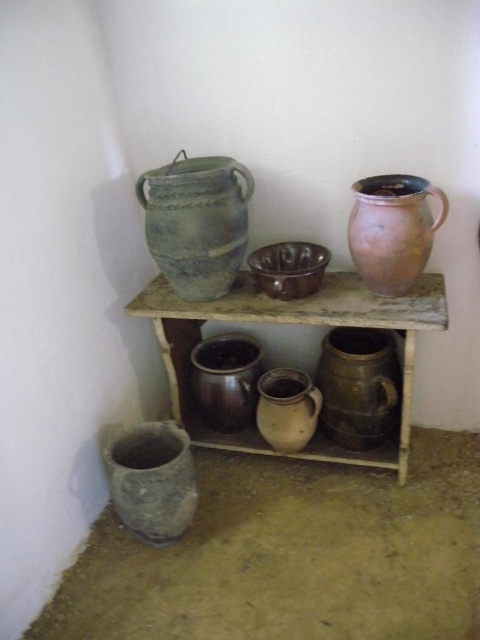
Question: Which point appears farthest from the camera in this image?

Choices:
 (A) (298, 438)
 (B) (300, 269)
 (C) (186, 529)

Answer: (B)

Question: Can you confirm if rusty ceramic pitcher at upper right is smaller than speckled clay vase at center?

Choices:
 (A) yes
 (B) no

Answer: (B)

Question: Which object is farther from the camera taking this photo?

Choices:
 (A) matte brown jug at center
 (B) matte brown pot at center

Answer: (B)

Question: Among these points, which one is farthest from the camera?

Choices:
 (A) (321, 412)
 (B) (300, 314)
 (C) (242, 362)
 (D) (128, 460)

Answer: (C)

Question: Where is matte brown jug at center located in relation to shiny metallic bowl at center in the image?

Choices:
 (A) above
 (B) below

Answer: (B)

Question: Can you confirm if rustic wood shelf at center is positioned above green earthenware pot at upper left?

Choices:
 (A) no
 (B) yes

Answer: (A)